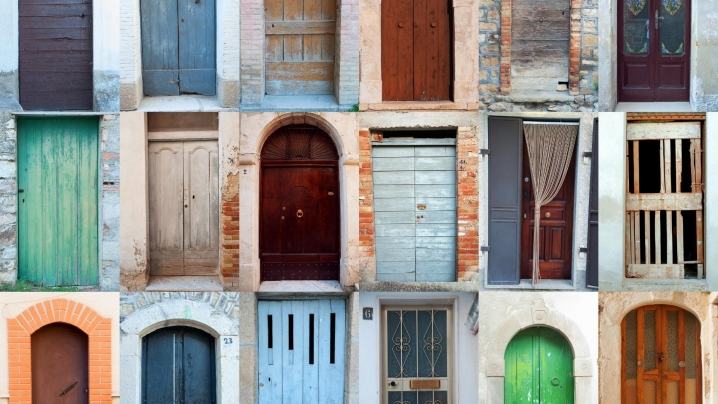
You are a GUI agent. You are given a task and a screenshot of the screen. Output one action in this format:
    pyautogui.click(x=<x>, y=<y>)
    Task: Click on the doors toward the right
    The width and height of the screenshot is (718, 404).
    Given the screenshot: What is the action you would take?
    pyautogui.click(x=541, y=48), pyautogui.click(x=653, y=42), pyautogui.click(x=541, y=206), pyautogui.click(x=658, y=201), pyautogui.click(x=668, y=366), pyautogui.click(x=533, y=378)